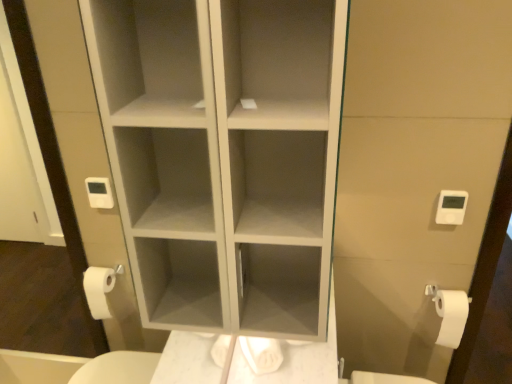
What do you see at coordinates (295, 361) in the screenshot?
I see `white marble counter top at center` at bounding box center [295, 361].

In order to face white marble counter top at center, should I rotate leftwards or rightwards?

Rotate your view right by about 5.307°.

Locate an element on the screen. The width and height of the screenshot is (512, 384). white marble counter top at center is located at coordinates (295, 361).

This screenshot has width=512, height=384. Find the location of `white marble counter top at center`. white marble counter top at center is located at coordinates (295, 361).